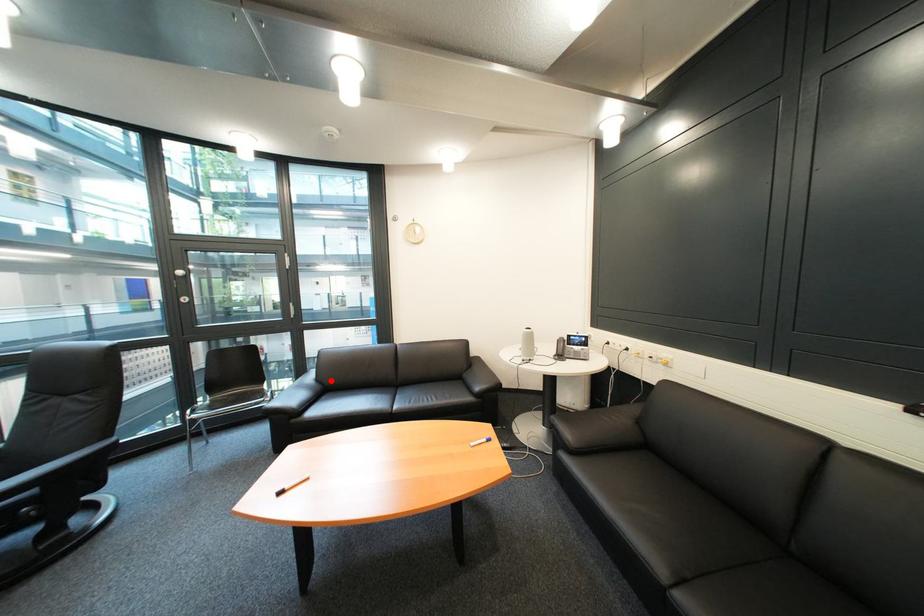
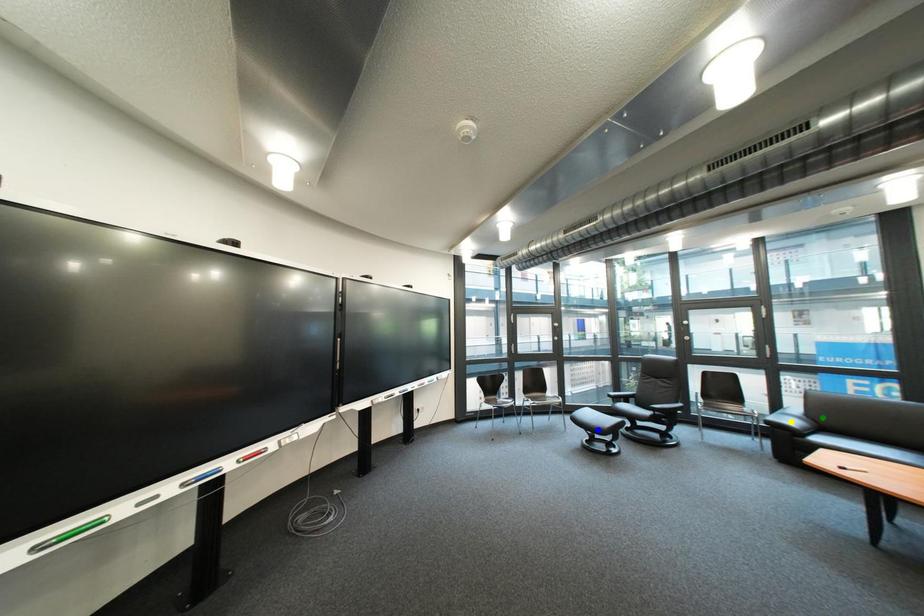
Question: I am providing you with two images of the same scene from different viewpoints. A red point is marked on the first image. You are given multiple points on the second image. Which point in image 2 represents the same 3d spot as the red point in image 1?

Choices:
 (A) blue point
 (B) green point
 (C) yellow point

Answer: (B)